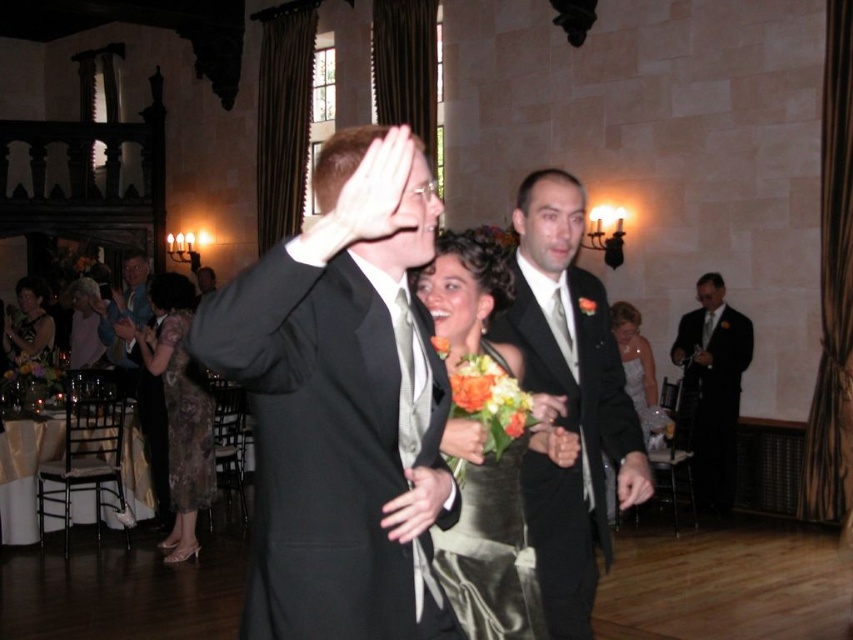
Based on the photo, you are a photographer at the wedding reception. You need to position yourself so that the black satin suit at center and the printed silk dress at lower left are both in frame. Based on their positions, which one should be placed to the right side of your camera frame?

The black satin suit at center is to the right of the printed silk dress at lower left, so you should place the black satin suit at center on the right side of your camera frame.

You are a photographer at the wedding reception. You want to take a photo of both the printed silk dress at lower left and the light blue suit at left. However, you notice that the printed silk dress is partially blocked by a large floral arrangement. To ensure both subjects are fully visible, should you move closer to or farther away from the floral arrangement?

The printed silk dress at lower left is not as tall as the light blue suit at left. To ensure both subjects are fully visible, you should move closer to the floral arrangement so that you can position yourself to capture both the shorter printed silk dress and the taller light blue suit without obstruction.